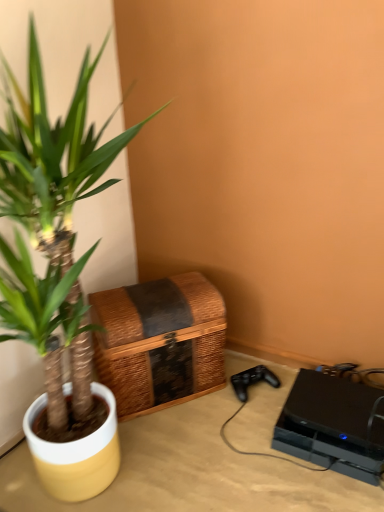
Find the location of `vacant space in front of black matte gaming console at lower right`. vacant space in front of black matte gaming console at lower right is located at coordinates (325, 490).